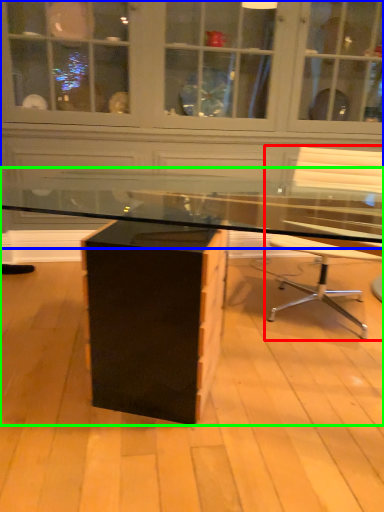
Question: Which object is the closest to the chair (highlighted by a red box)? Choose among these: dresser (highlighted by a blue box) or desk (highlighted by a green box).

Choices:
 (A) dresser
 (B) desk

Answer: (B)